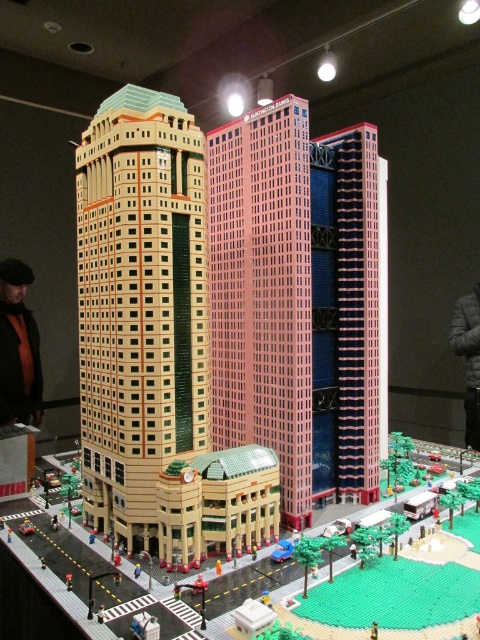
Question: Is beige brick building at center positioned at the back of blue glass building at center?

Choices:
 (A) no
 (B) yes

Answer: (A)

Question: Can you confirm if pink plastic building at center is positioned to the right of orange scarf at left?

Choices:
 (A) yes
 (B) no

Answer: (A)

Question: Which of the following is the farthest from the observer?

Choices:
 (A) (467, 412)
 (B) (4, 384)

Answer: (A)

Question: Which of the following is the farthest from the observer?

Choices:
 (A) (6, 266)
 (B) (128, 321)
 (C) (370, 404)

Answer: (A)

Question: Which of the following is the closest to the observer?

Choices:
 (A) gray fabric jacket at upper right
 (B) pink plastic building at center
 (C) blue glass building at center
 (D) orange scarf at left

Answer: (B)

Question: Can you confirm if beige brick building at center is positioned to the left of blue glass building at center?

Choices:
 (A) yes
 (B) no

Answer: (A)